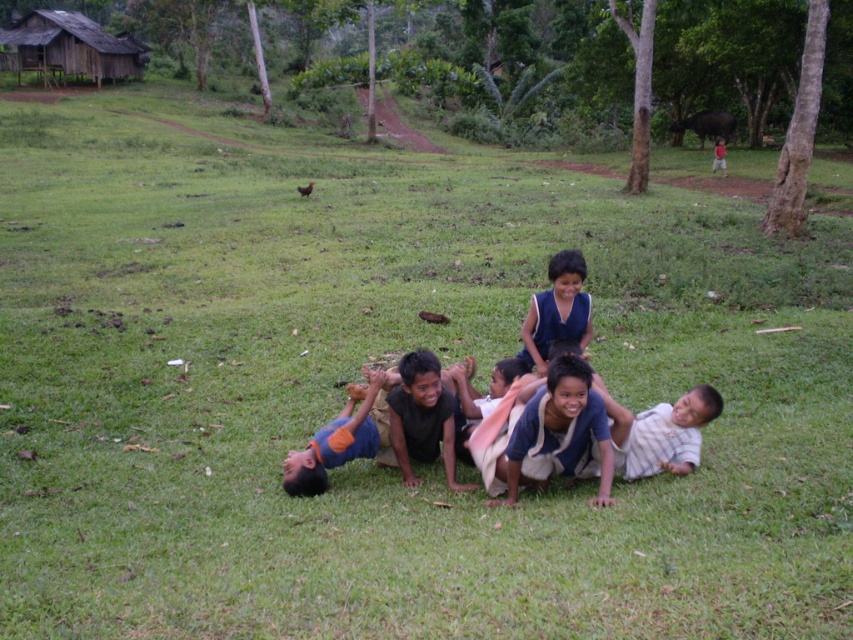
Question: Can you confirm if dark blue shirt at lower center is positioned above blue fabric shirt at center?

Choices:
 (A) no
 (B) yes

Answer: (A)

Question: Which point is farther to the camera?

Choices:
 (A) blue cotton shirt at center
 (B) red cotton shirt at upper right
 (C) dark blue shirt at lower center

Answer: (B)

Question: Can you confirm if blue fabric shirt at center is thinner than red cotton shirt at upper right?

Choices:
 (A) no
 (B) yes

Answer: (B)

Question: Can you confirm if blue cotton shirt at center is wider than brown wooden hut at upper left?

Choices:
 (A) no
 (B) yes

Answer: (A)

Question: Which point is farther to the camera?

Choices:
 (A) red cotton shirt at upper right
 (B) brown wooden hut at upper left
 (C) blue cotton shirt at center
 (D) blue fabric shirt at center

Answer: (B)

Question: Which object is closer to the camera taking this photo?

Choices:
 (A) red cotton shirt at upper right
 (B) blue fabric shirt at center
 (C) dark blue shirt at lower center
 (D) brown wooden hut at upper left

Answer: (C)